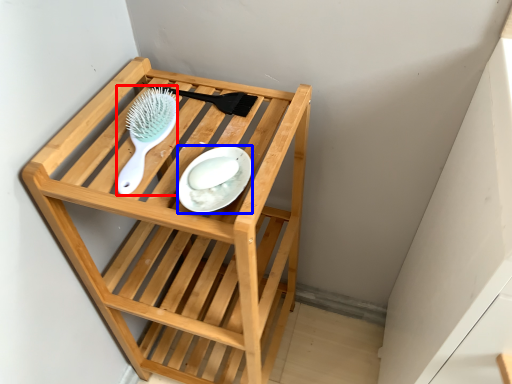
Question: Among these objects, which one is farthest to the camera, brush (highlighted by a red box) or plate (highlighted by a blue box)?

Choices:
 (A) brush
 (B) plate

Answer: (A)